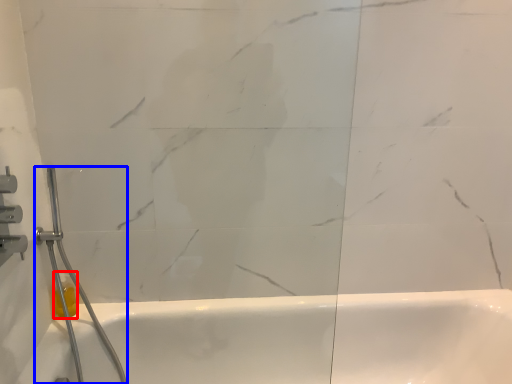
Question: Among these objects, which one is farthest to the camera, toiletry (highlighted by a red box) or shower (highlighted by a blue box)?

Choices:
 (A) toiletry
 (B) shower

Answer: (A)